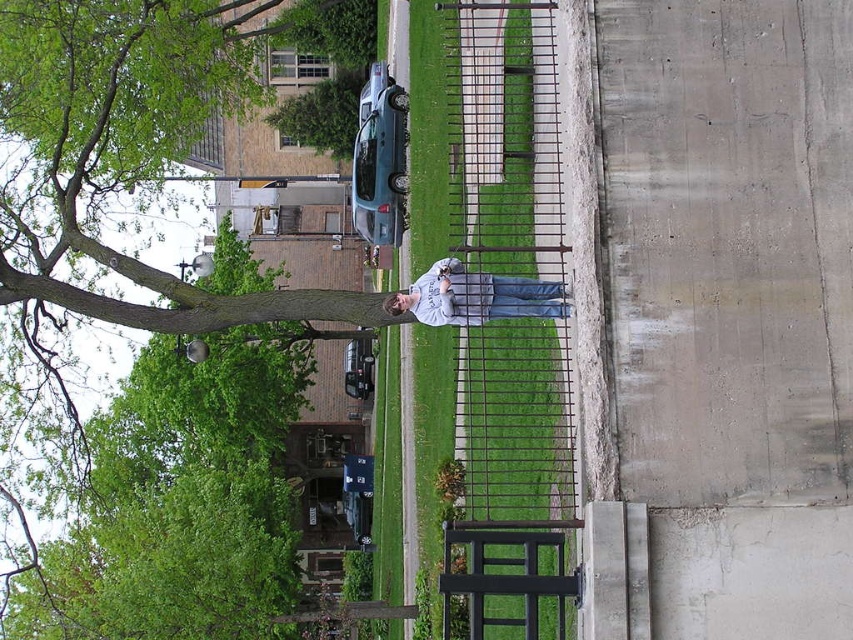
Question: Which of the following is the farthest from the observer?

Choices:
 (A) light gray sweatshirt at center
 (B) teal matte car at center

Answer: (B)

Question: Which object is positioned closest to the teal matte car at center?

Choices:
 (A) green grass at center
 (B) light gray sweatshirt at center

Answer: (A)

Question: Considering the relative positions of green grass at center and teal matte car at center in the image provided, where is green grass at center located with respect to teal matte car at center?

Choices:
 (A) below
 (B) above

Answer: (A)

Question: Estimate the real-world distances between objects in this image. Which object is farther from the green rough bark tree at upper left?

Choices:
 (A) teal matte car at center
 (B) green grass at center
 (C) light gray sweatshirt at center

Answer: (C)

Question: Is green grass at center above teal matte car at center?

Choices:
 (A) no
 (B) yes

Answer: (A)

Question: Can you confirm if green grass at center is wider than green rough bark tree at upper left?

Choices:
 (A) yes
 (B) no

Answer: (B)